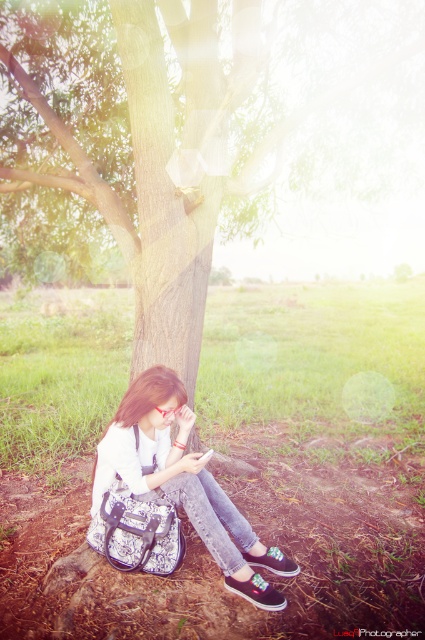
Which is more to the right, white textured bag at lower center or black canvas shoe at lower center?

Positioned to the right is black canvas shoe at lower center.

You are a GUI agent. You are given a task and a screenshot of the screen. Output one action in this format:
    pyautogui.click(x=<x>, y=<y>)
    Task: Click on the white textured bag at lower center
    Image resolution: width=425 pixels, height=640 pixels.
    Given the screenshot: What is the action you would take?
    pyautogui.click(x=167, y=492)

Is point (102, 525) positioned before point (257, 577)?

No, it is behind (257, 577).

The width and height of the screenshot is (425, 640). Identify the location of white textured bag at lower center. (167, 492).

Does point (104, 493) lie in front of point (130, 372)?

Yes, point (104, 493) is in front of point (130, 372).

Measure the distance between white textured bag at lower center and brown rough tree trunk at left.

They are 1.18 meters apart.

This screenshot has width=425, height=640. I want to click on white textured bag at lower center, so click(x=167, y=492).

Find the location of a particular element. The height and width of the screenshot is (640, 425). white textured bag at lower center is located at coordinates (167, 492).

Who is more forward, [129,77] or [277,573]?

→ Point [277,573]

Is point (135, 147) behind point (255, 561)?

Yes, it is behind point (255, 561).

The height and width of the screenshot is (640, 425). What do you see at coordinates (161, 209) in the screenshot?
I see `brown rough tree trunk at left` at bounding box center [161, 209].

This screenshot has height=640, width=425. Find the location of `brown rough tree trunk at left`. brown rough tree trunk at left is located at coordinates (161, 209).